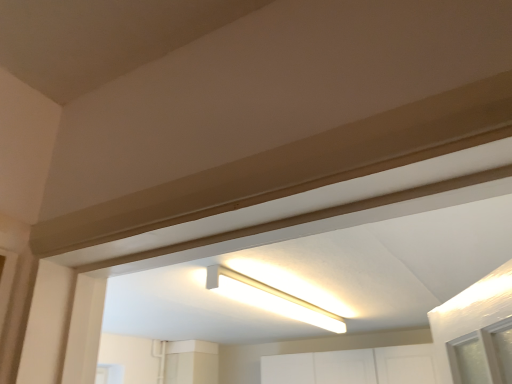
What do you see at coordinates (270, 298) in the screenshot?
I see `white matte fluorescent light at center` at bounding box center [270, 298].

Where is `white matte fluorescent light at center`? The image size is (512, 384). white matte fluorescent light at center is located at coordinates (270, 298).

What is the approximate height of white matte fluorescent light at center?

It is 3.75 inches.

Find the location of a particular element. This screenshot has height=384, width=512. white matte fluorescent light at center is located at coordinates (270, 298).